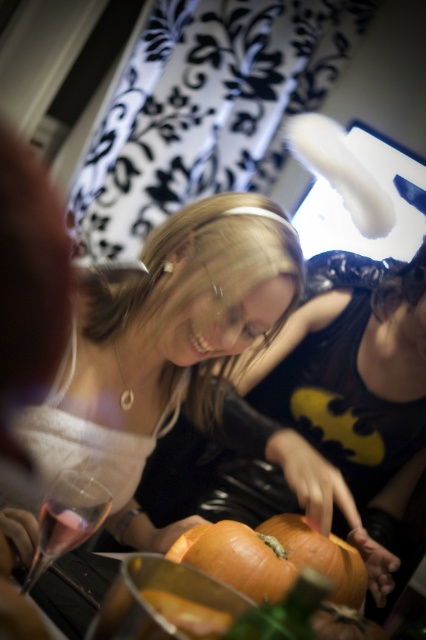
Who is more distant from viewer, (143, 387) or (196, 557)?

The point (143, 387) is more distant.

Who is more forward, (233,314) or (224,529)?

Point (224,529) is more forward.

Image resolution: width=426 pixels, height=640 pixels. In order to click on matte white hairband at center in this screenshot , I will do `click(164, 348)`.

What do you see at coordinates (164, 348) in the screenshot? This screenshot has height=640, width=426. I see `matte white hairband at center` at bounding box center [164, 348].

This screenshot has height=640, width=426. Describe the element at coordinates (164, 348) in the screenshot. I see `matte white hairband at center` at that location.

This screenshot has height=640, width=426. In order to click on matte white hairband at center in this screenshot , I will do `click(164, 348)`.

Can you confirm if orange matte pumpkin at center is positioned above clear glass wine glass at lower left?

No.

In order to click on orange matte pumpkin at center in this screenshot , I will do `click(271, 557)`.

This screenshot has width=426, height=640. Describe the element at coordinates (271, 557) in the screenshot. I see `orange matte pumpkin at center` at that location.

Identify the location of orange matte pumpkin at center. The height and width of the screenshot is (640, 426). (271, 557).